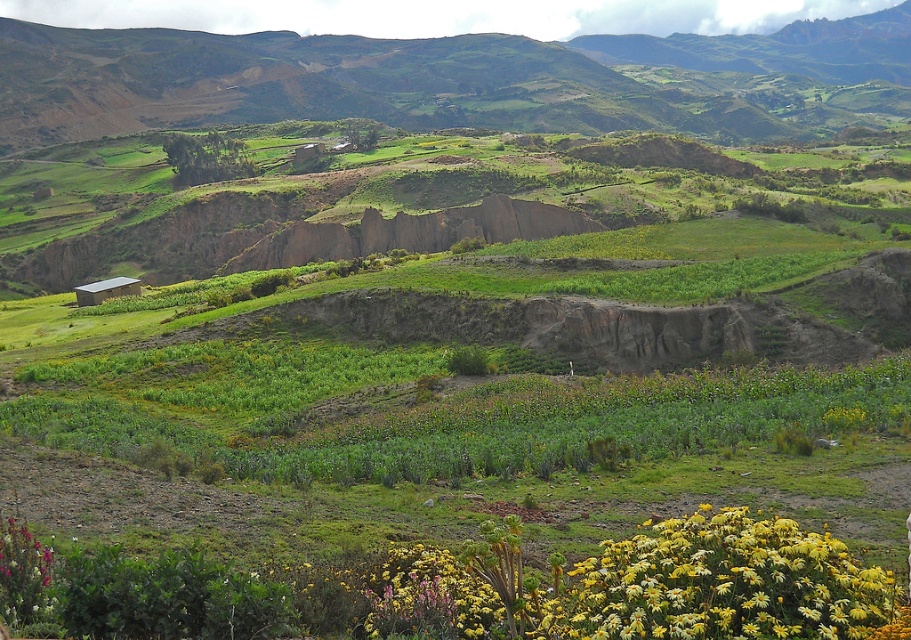
You are standing in the rural landscape and want to reach a specific point marked as point (181, 33). Given that you can walk at a speed of 5 kilometers per hour, approximately how long will it take you to reach that point?

The distance between point (181, 33) and the viewer is 519.98 meters. Converting this to kilometers gives 0.51998 km. Dividing by your walking speed of 5 km per hour yields approximately 0.104 hours, which is roughly 6.24 minutes. Therefore, it will take about 6 minutes to reach point (181, 33).

You are a hiker planning to take a photo of the green grassy hill at upper center and the yellow matte flower at lower right. Which object should you focus on first if you want to capture both in one frame without moving the camera?

You should focus on the green grassy hill at upper center first because it is wider than the yellow matte flower at lower right, so it will take up more space in the frame.